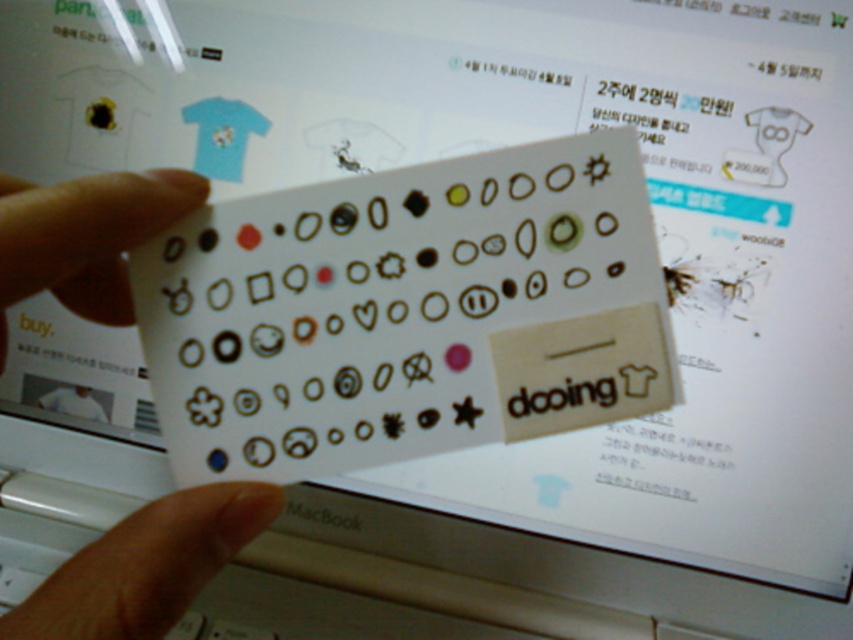
Question: Can you confirm if translucent plastic hand at center is wider than skinny flesh-colored hand at lower left?

Choices:
 (A) yes
 (B) no

Answer: (A)

Question: Considering the relative positions of translucent plastic hand at center and matte plastic hand at center in the image provided, where is translucent plastic hand at center located with respect to matte plastic hand at center?

Choices:
 (A) above
 (B) below

Answer: (B)

Question: Which point is closer to the camera?

Choices:
 (A) translucent plastic hand at center
 (B) matte plastic hand at center
 (C) skinny flesh-colored hand at lower left

Answer: (A)

Question: Which point is farther from the camera taking this photo?

Choices:
 (A) (189, 589)
 (B) (180, 518)
 (C) (16, 252)

Answer: (A)

Question: Which point appears farthest from the camera in this image?

Choices:
 (A) (9, 198)
 (B) (196, 492)

Answer: (B)

Question: Is the position of translucent plastic hand at center more distant than that of matte plastic hand at center?

Choices:
 (A) no
 (B) yes

Answer: (A)